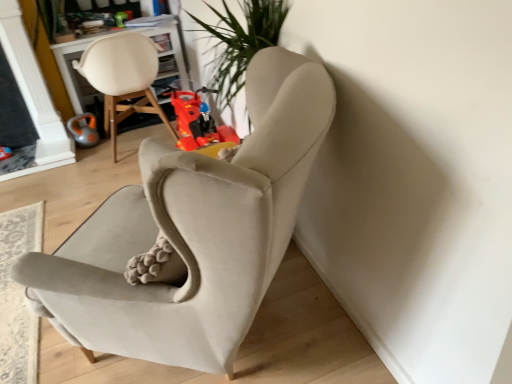
Question: Which direction should I rotate to face suede beige armchair at center, the first chair viewed from the right, — up or down?

Choices:
 (A) up
 (B) down

Answer: (B)

Question: Is suede beige armchair at center, positioned as the second chair in left-to-right order, behind rubberized plastic toy motorcycle at center, which is the first toy in right-to-left order?

Choices:
 (A) yes
 (B) no

Answer: (B)

Question: From the image's perspective, does suede beige armchair at center, the first chair viewed from the right, appear higher than rubberized plastic toy motorcycle at center, the second toy in the left-to-right sequence?

Choices:
 (A) yes
 (B) no

Answer: (B)

Question: Considering the relative sizes of suede beige armchair at center, positioned as the second chair in left-to-right order, and rubberized plastic toy motorcycle at center, which is the first toy in right-to-left order, in the image provided, is suede beige armchair at center, positioned as the second chair in left-to-right order, shorter than rubberized plastic toy motorcycle at center, which is the first toy in right-to-left order,?

Choices:
 (A) no
 (B) yes

Answer: (B)

Question: From a real-world perspective, is suede beige armchair at center, positioned as the second chair in left-to-right order, beneath rubberized plastic toy motorcycle at center, which is the first toy in right-to-left order?

Choices:
 (A) no
 (B) yes

Answer: (B)

Question: Does suede beige armchair at center, positioned as the second chair in left-to-right order, appear on the left side of rubberized plastic toy motorcycle at center, the second toy in the left-to-right sequence?

Choices:
 (A) yes
 (B) no

Answer: (A)

Question: Is rubberized plastic toy motorcycle at center, the second toy in the left-to-right sequence, completely or partially inside suede beige armchair at center, positioned as the second chair in left-to-right order?

Choices:
 (A) no
 (B) yes

Answer: (A)

Question: Considering the relative sizes of orange rubber toy at left, marked as the first toy in a left-to-right arrangement, and matte white chair at upper left, marked as the 1th chair in a left-to-right arrangement, in the image provided, is orange rubber toy at left, marked as the first toy in a left-to-right arrangement, wider than matte white chair at upper left, marked as the 1th chair in a left-to-right arrangement,?

Choices:
 (A) no
 (B) yes

Answer: (A)

Question: From a real-world perspective, is orange rubber toy at left, which is the second toy from right to left, below matte white chair at upper left, marked as the 1th chair in a left-to-right arrangement?

Choices:
 (A) yes
 (B) no

Answer: (A)

Question: From the image's perspective, would you say orange rubber toy at left, which is the second toy from right to left, is shown under matte white chair at upper left, marked as the 1th chair in a left-to-right arrangement?

Choices:
 (A) yes
 (B) no

Answer: (A)

Question: Considering the relative sizes of orange rubber toy at left, marked as the first toy in a left-to-right arrangement, and matte white chair at upper left, which appears as the second chair when viewed from the right, in the image provided, is orange rubber toy at left, marked as the first toy in a left-to-right arrangement, shorter than matte white chair at upper left, which appears as the second chair when viewed from the right,?

Choices:
 (A) yes
 (B) no

Answer: (A)

Question: From a real-world perspective, is orange rubber toy at left, marked as the first toy in a left-to-right arrangement, physically above matte white chair at upper left, which appears as the second chair when viewed from the right?

Choices:
 (A) no
 (B) yes

Answer: (A)

Question: Is orange rubber toy at left, marked as the first toy in a left-to-right arrangement, to the right of matte white chair at upper left, which appears as the second chair when viewed from the right, from the viewer's perspective?

Choices:
 (A) no
 (B) yes

Answer: (A)

Question: From the image's perspective, does rubberized plastic toy motorcycle at center, which is the first toy in right-to-left order, appear higher than orange rubber toy at left, marked as the first toy in a left-to-right arrangement?

Choices:
 (A) yes
 (B) no

Answer: (B)